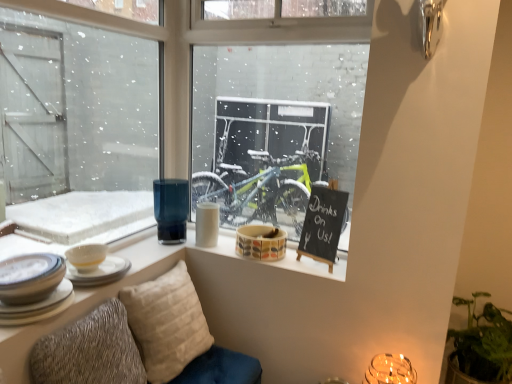
Question: Is black chalkboard at upper right looking in the opposite direction of green leafy plant at lower right?

Choices:
 (A) no
 (B) yes

Answer: (A)

Question: Does black chalkboard at upper right touch green leafy plant at lower right?

Choices:
 (A) yes
 (B) no

Answer: (B)

Question: Does black chalkboard at upper right have a greater width compared to green leafy plant at lower right?

Choices:
 (A) yes
 (B) no

Answer: (B)

Question: Is black chalkboard at upper right behind green leafy plant at lower right?

Choices:
 (A) yes
 (B) no

Answer: (A)

Question: Does black chalkboard at upper right contain green leafy plant at lower right?

Choices:
 (A) yes
 (B) no

Answer: (B)

Question: Is black chalkboard at upper right completely or partially outside of green leafy plant at lower right?

Choices:
 (A) yes
 (B) no

Answer: (A)

Question: Does translucent glass candle holder at lower right turn towards white ceramic bowl at left, the first tableware from the left?

Choices:
 (A) yes
 (B) no

Answer: (B)

Question: Is translucent glass candle holder at lower right wider than white ceramic bowl at left, the first tableware from the left?

Choices:
 (A) no
 (B) yes

Answer: (A)

Question: Is translucent glass candle holder at lower right behind white ceramic bowl at left, the first tableware from the left?

Choices:
 (A) no
 (B) yes

Answer: (B)

Question: From a real-world perspective, is translucent glass candle holder at lower right physically above white ceramic bowl at left, which appears as the 7th tableware when viewed from the right?

Choices:
 (A) yes
 (B) no

Answer: (B)

Question: Is white ceramic bowl at left, the first tableware from the left, at the back of translucent glass candle holder at lower right?

Choices:
 (A) no
 (B) yes

Answer: (A)

Question: From the image's perspective, is translucent glass candle holder at lower right on white ceramic bowl at left, which appears as the 7th tableware when viewed from the right?

Choices:
 (A) yes
 (B) no

Answer: (B)

Question: Can you confirm if black chalkboard at upper right is thinner than white ceramic plates at lower left, the 2th tableware from the left?

Choices:
 (A) no
 (B) yes

Answer: (B)